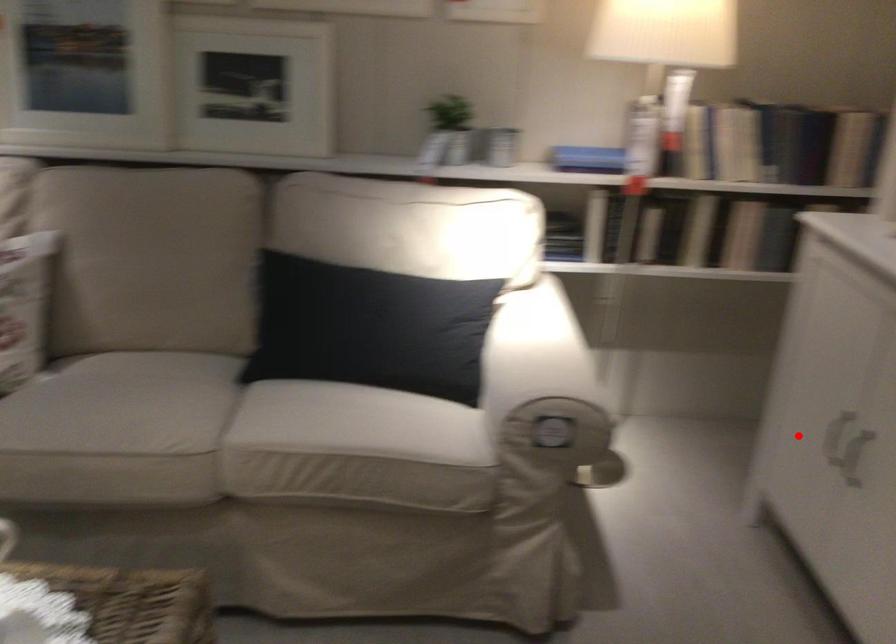
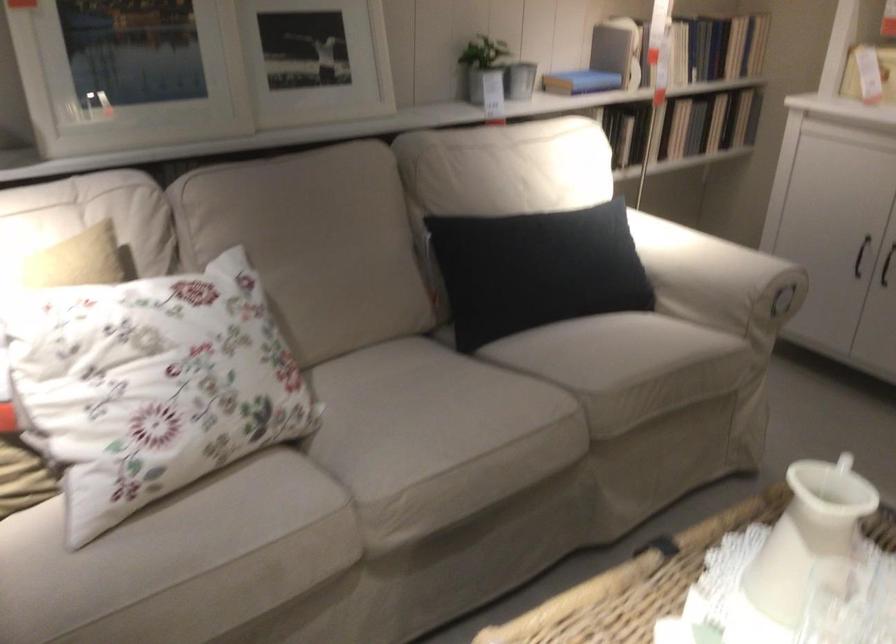
Find the pixel in the second image that matches the highlighted location in the first image.

(860, 256)